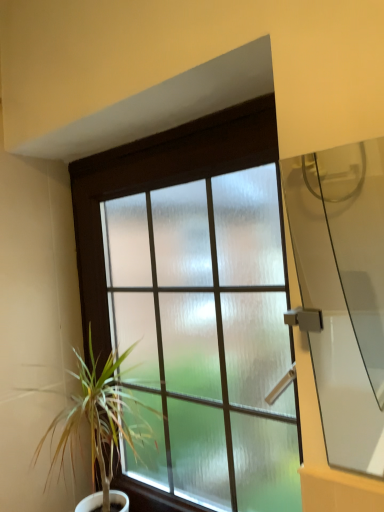
Question: Is frosted glass window at center at the right side of transparent glass door at right?

Choices:
 (A) no
 (B) yes

Answer: (A)

Question: From the image's perspective, is frosted glass window at center under transparent glass door at right?

Choices:
 (A) yes
 (B) no

Answer: (A)

Question: Does frosted glass window at center appear on the left side of transparent glass door at right?

Choices:
 (A) no
 (B) yes

Answer: (B)

Question: Considering the relative sizes of frosted glass window at center and transparent glass door at right in the image provided, is frosted glass window at center thinner than transparent glass door at right?

Choices:
 (A) yes
 (B) no

Answer: (B)

Question: From a real-world perspective, does frosted glass window at center stand above transparent glass door at right?

Choices:
 (A) no
 (B) yes

Answer: (A)

Question: Is frosted glass window at center facing towards transparent glass door at right?

Choices:
 (A) yes
 (B) no

Answer: (B)

Question: Can you confirm if green leafy plant at left is smaller than frosted glass window at center?

Choices:
 (A) no
 (B) yes

Answer: (B)

Question: Is green leafy plant at left closer to the viewer compared to frosted glass window at center?

Choices:
 (A) yes
 (B) no

Answer: (B)

Question: Is green leafy plant at left bigger than frosted glass window at center?

Choices:
 (A) yes
 (B) no

Answer: (B)

Question: Would you say green leafy plant at left contains frosted glass window at center?

Choices:
 (A) no
 (B) yes

Answer: (A)

Question: Does green leafy plant at left turn towards frosted glass window at center?

Choices:
 (A) no
 (B) yes

Answer: (A)

Question: From a real-world perspective, is green leafy plant at left over frosted glass window at center?

Choices:
 (A) yes
 (B) no

Answer: (B)

Question: Is green leafy plant at left at the left side of transparent glass door at right?

Choices:
 (A) no
 (B) yes

Answer: (B)